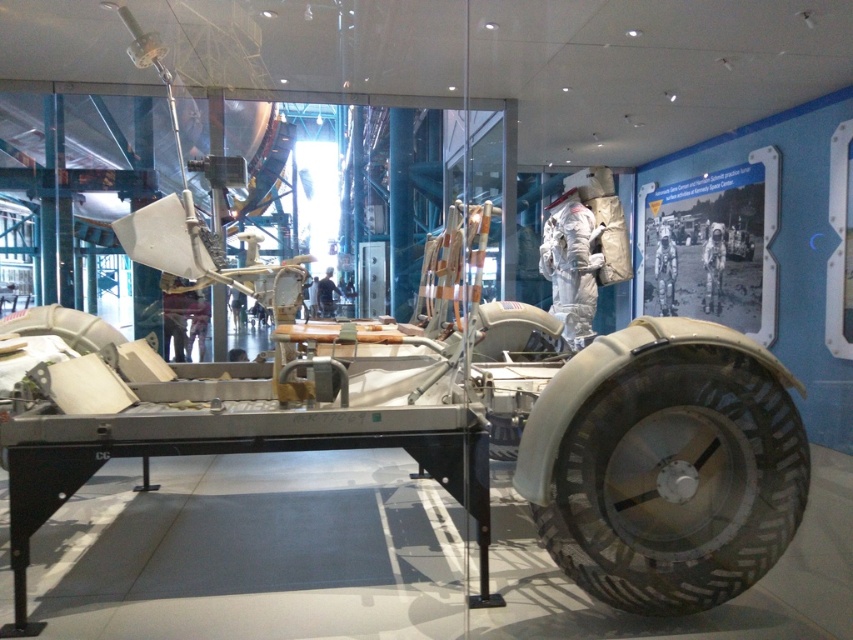
Question: Does rubber textured tire at lower right have a smaller size compared to white spacesuit at center?

Choices:
 (A) yes
 (B) no

Answer: (B)

Question: Is rubber textured tire at lower right closer to the viewer compared to white spacesuit at center?

Choices:
 (A) no
 (B) yes

Answer: (B)

Question: Considering the real-world distances, which object is farthest from the black fabric man at center?

Choices:
 (A) white spacesuit at center
 (B) rubber textured tire at lower right

Answer: (B)

Question: Is white spacesuit at center positioned in front of black fabric man at center?

Choices:
 (A) yes
 (B) no

Answer: (A)

Question: Which point appears closest to the camera in this image?

Choices:
 (A) (320, 284)
 (B) (660, 305)
 (C) (624, 512)

Answer: (C)

Question: Which point is farther to the camera?

Choices:
 (A) (659, 592)
 (B) (675, 259)
 (C) (317, 296)

Answer: (C)